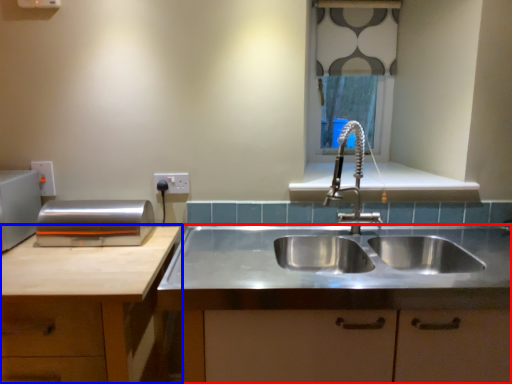
Question: Which point is closer to the camera, countertop (highlighted by a red box) or cabinetry (highlighted by a blue box)?

Choices:
 (A) countertop
 (B) cabinetry

Answer: (B)